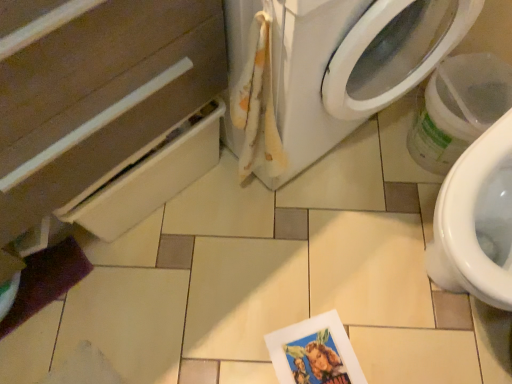
Find the location of a particular element. empty space that is ontop of printed paper postcard at lower center (from a real-world perspective) is located at coordinates (328, 352).